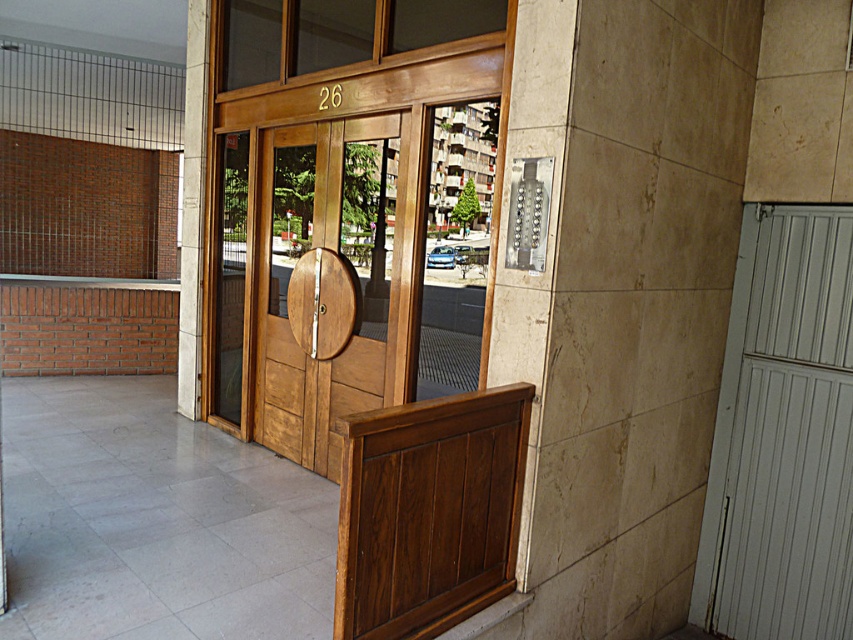
Locate an element on the screen. transparent wood door at center is located at coordinates (346, 268).

Which is below, transparent wood door at center or smooth concrete pillar at left?

transparent wood door at center

At what (x,y) coordinates should I click in order to perform the action: click on transparent wood door at center. Please return your answer as a coordinate pair (x, y). The width and height of the screenshot is (853, 640). Looking at the image, I should click on (346, 268).